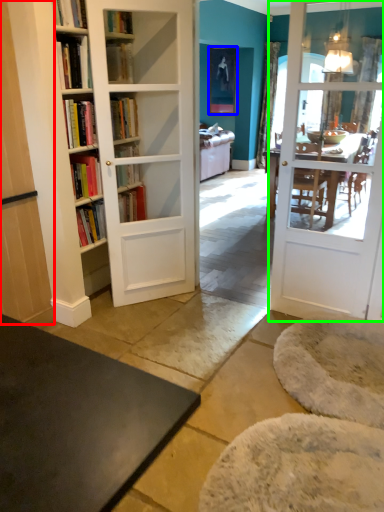
Question: Estimate the real-world distances between objects in this image. Which object is closer to cabinetry (highlighted by a red box), picture frame (highlighted by a blue box) or door (highlighted by a green box)?

Choices:
 (A) picture frame
 (B) door

Answer: (B)